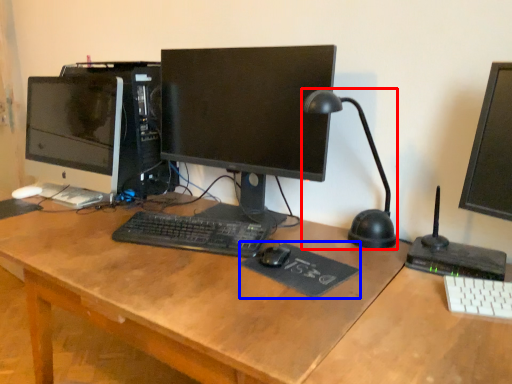
Question: Which object is further to the camera taking this photo, table lamp (highlighted by a red box) or mousepad (highlighted by a blue box)?

Choices:
 (A) table lamp
 (B) mousepad

Answer: (B)